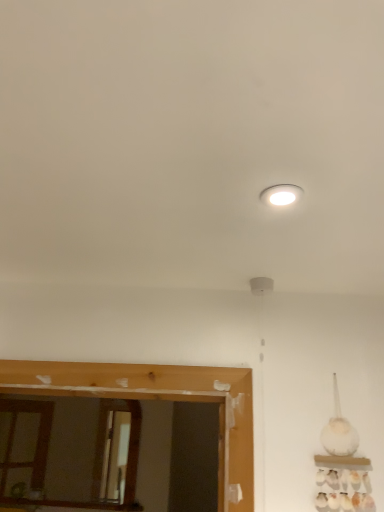
Question: From a real-world perspective, is wooden mirror at lower left physically located above or below white glossy light fixture at upper center?

Choices:
 (A) above
 (B) below

Answer: (B)

Question: Is wooden mirror at lower left to the left or to the right of white glossy light fixture at upper center in the image?

Choices:
 (A) left
 (B) right

Answer: (A)

Question: Is wooden mirror at lower left spatially inside white glossy light fixture at upper center, or outside of it?

Choices:
 (A) outside
 (B) inside

Answer: (A)

Question: From a real-world perspective, is white glossy light fixture at upper center positioned above or below wooden mirror at lower left?

Choices:
 (A) above
 (B) below

Answer: (A)

Question: From the image's perspective, is white glossy light fixture at upper center above or below wooden mirror at lower left?

Choices:
 (A) below
 (B) above

Answer: (B)

Question: Considering the positions of white glossy light fixture at upper center and wooden mirror at lower left in the image, is white glossy light fixture at upper center wider or thinner than wooden mirror at lower left?

Choices:
 (A) wide
 (B) thin

Answer: (A)

Question: In terms of height, does white glossy light fixture at upper center look taller or shorter compared to wooden mirror at lower left?

Choices:
 (A) short
 (B) tall

Answer: (A)